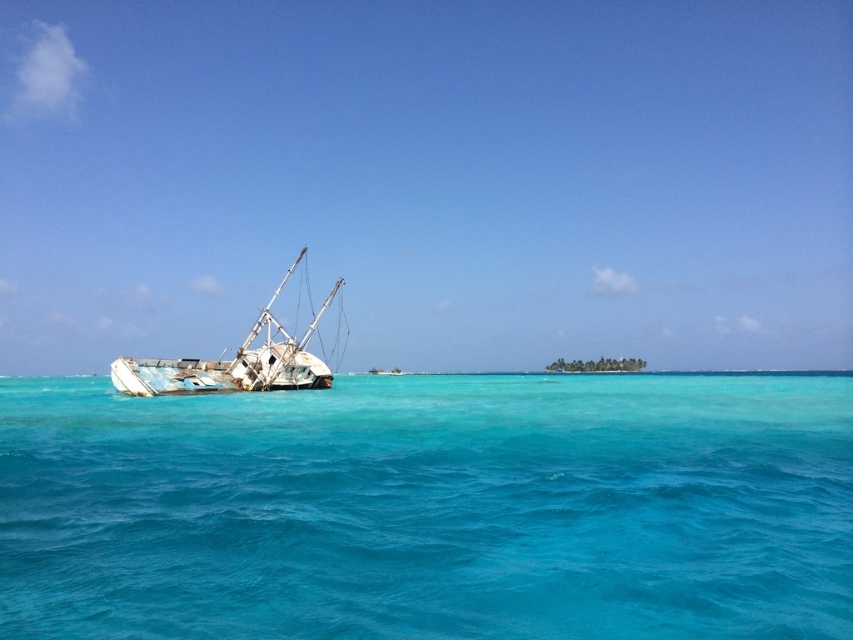
You are a marine biologist studying underwater environments. You notice the clear blue water at left and the rusty metal boat at left in the scene. Which of these two has a larger visible area in the image?

The clear blue water at left has a larger visible area than the rusty metal boat at left because the clear blue water at left is bigger than the rusty metal boat at left.

You are a marine biologist studying the underwater environment. You have a device that can only operate within a 0.1 unit radius around the point specified in the Objects Description. Based on the scene, can you determine if the clear blue water at left is suitable for deploying your device?

The clear blue water at left is located at point (430, 508). Since the device can operate within a 0.1 unit radius around this point, the clear blue water at left is suitable for deploying the device as it falls within the required area.